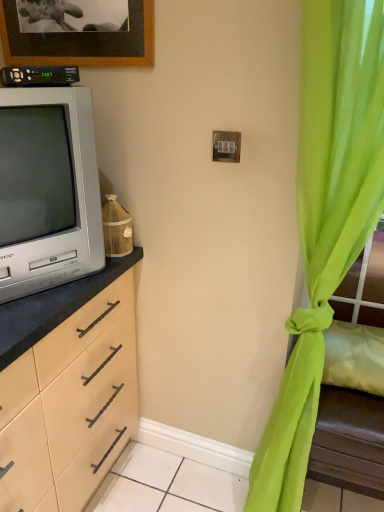
Question: From the image's perspective, is green sheer curtain at right on black plastic remote control at upper left?

Choices:
 (A) no
 (B) yes

Answer: (A)

Question: From the image's perspective, would you say green sheer curtain at right is shown under black plastic remote control at upper left?

Choices:
 (A) no
 (B) yes

Answer: (B)

Question: Does green sheer curtain at right turn towards black plastic remote control at upper left?

Choices:
 (A) no
 (B) yes

Answer: (A)

Question: Is green sheer curtain at right not within black plastic remote control at upper left?

Choices:
 (A) yes
 (B) no

Answer: (A)

Question: Is green sheer curtain at right looking in the opposite direction of black plastic remote control at upper left?

Choices:
 (A) no
 (B) yes

Answer: (A)

Question: Considering their positions, is black plastic remote control at upper left located in front of or behind white plastic switch at center?

Choices:
 (A) behind
 (B) front

Answer: (B)

Question: From the image's perspective, is black plastic remote control at upper left above or below white plastic switch at center?

Choices:
 (A) above
 (B) below

Answer: (A)

Question: Considering the positions of black plastic remote control at upper left and white plastic switch at center in the image, is black plastic remote control at upper left bigger or smaller than white plastic switch at center?

Choices:
 (A) small
 (B) big

Answer: (B)

Question: In terms of width, does black plastic remote control at upper left look wider or thinner when compared to white plastic switch at center?

Choices:
 (A) thin
 (B) wide

Answer: (B)

Question: Is green sheer curtain at right inside the boundaries of matte gray television at left, or outside?

Choices:
 (A) outside
 (B) inside

Answer: (A)

Question: From their relative heights in the image, would you say green sheer curtain at right is taller or shorter than matte gray television at left?

Choices:
 (A) tall
 (B) short

Answer: (A)

Question: From the image's perspective, is green sheer curtain at right above or below matte gray television at left?

Choices:
 (A) above
 (B) below

Answer: (B)

Question: Considering their positions, is green sheer curtain at right located in front of or behind matte gray television at left?

Choices:
 (A) behind
 (B) front

Answer: (B)

Question: Is black plastic remote control at upper left spatially inside green sheer curtain at right, or outside of it?

Choices:
 (A) inside
 (B) outside

Answer: (B)

Question: In terms of width, does black plastic remote control at upper left look wider or thinner when compared to green sheer curtain at right?

Choices:
 (A) thin
 (B) wide

Answer: (A)